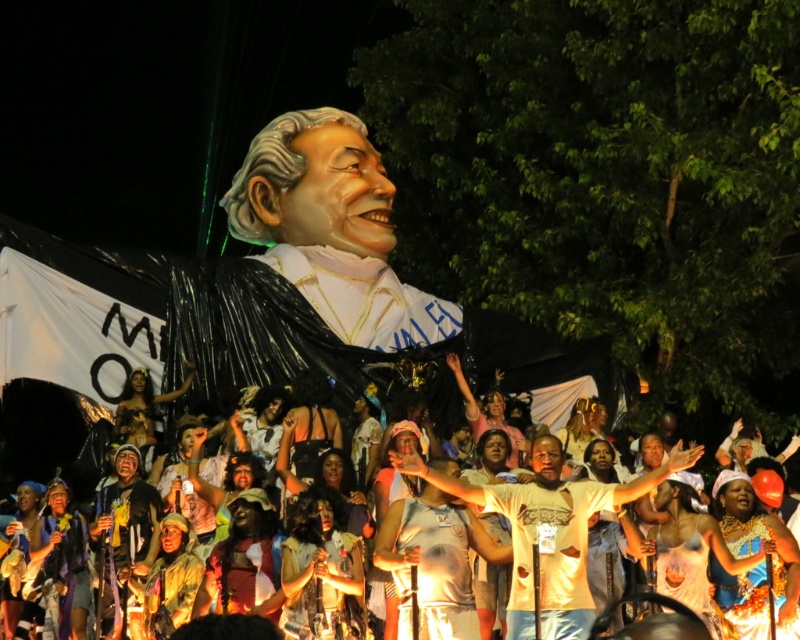
Can you confirm if white t-shirt at center is positioned to the right of white matte statue at center?

Indeed, white t-shirt at center is positioned on the right side of white matte statue at center.

At what (x,y) coordinates should I click in order to perform the action: click on white t-shirt at center. Please return your answer as a coordinate pair (x, y). Looking at the image, I should click on (548, 531).